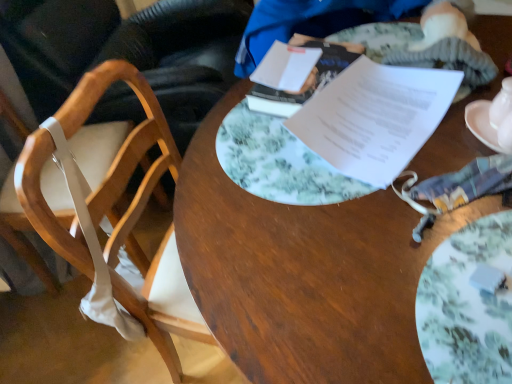
Question: Can you confirm if porcelain floral plate at center is wider than white glossy teapot at upper right?

Choices:
 (A) no
 (B) yes

Answer: (B)

Question: Is porcelain floral plate at center oriented towards white glossy teapot at upper right?

Choices:
 (A) yes
 (B) no

Answer: (A)

Question: Would you consider porcelain floral plate at center to be distant from white glossy teapot at upper right?

Choices:
 (A) yes
 (B) no

Answer: (B)

Question: Is porcelain floral plate at center closer to camera compared to white glossy teapot at upper right?

Choices:
 (A) yes
 (B) no

Answer: (A)

Question: Considering the relative positions of porcelain floral plate at center and white glossy teapot at upper right in the image provided, is porcelain floral plate at center to the left of white glossy teapot at upper right from the viewer's perspective?

Choices:
 (A) no
 (B) yes

Answer: (B)

Question: From a real-world perspective, is porcelain floral plate at center on white glossy teapot at upper right?

Choices:
 (A) no
 (B) yes

Answer: (A)

Question: Is white paper at center, marked as the 1th journal in a front-to-back arrangement, positioned with its back to white fabric chair at left, acting as the first chair starting from the right?

Choices:
 (A) yes
 (B) no

Answer: (B)

Question: From a real-world perspective, is white paper at center, marked as the 1th journal in a front-to-back arrangement, over white fabric chair at left, acting as the first chair starting from the right?

Choices:
 (A) no
 (B) yes

Answer: (B)

Question: Can you confirm if white paper at center, marked as the 1th journal in a front-to-back arrangement, is positioned to the right of white fabric chair at left, arranged as the second chair when viewed from the left?

Choices:
 (A) no
 (B) yes

Answer: (B)

Question: From a real-world perspective, is white paper at center, which is the second journal from back to front, positioned under white fabric chair at left, acting as the first chair starting from the right, based on gravity?

Choices:
 (A) yes
 (B) no

Answer: (B)

Question: From the image's perspective, would you say white paper at center, marked as the 1th journal in a front-to-back arrangement, is positioned over white fabric chair at left, acting as the first chair starting from the right?

Choices:
 (A) yes
 (B) no

Answer: (A)

Question: Can you confirm if white paper at center, marked as the 1th journal in a front-to-back arrangement, is thinner than white fabric chair at left, acting as the first chair starting from the right?

Choices:
 (A) no
 (B) yes

Answer: (A)

Question: Is wooden chair at left, which is the 1th chair from left to right, facing towards white paper at center, marked as the 1th journal in a front-to-back arrangement?

Choices:
 (A) yes
 (B) no

Answer: (A)